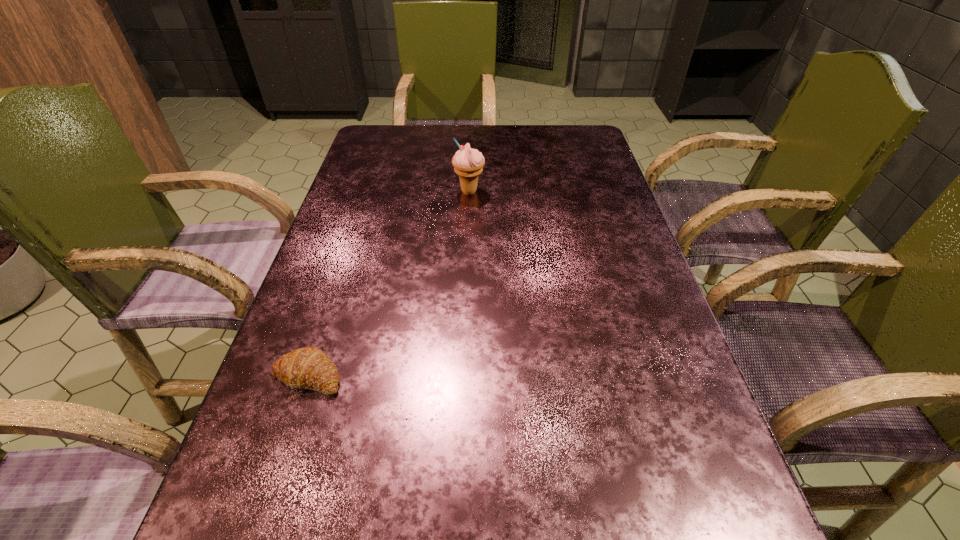
Image resolution: width=960 pixels, height=540 pixels. I want to click on the tallest object, so click(x=468, y=163).

This screenshot has height=540, width=960. Find the location of `the farthest object`. the farthest object is located at coordinates (468, 163).

I want to click on the second nearest object, so click(x=306, y=368).

You are a GUI agent. You are given a task and a screenshot of the screen. Output one action in this format:
    pyautogui.click(x=<x>, y=<y>)
    Task: Click on the farther crescent roll
    
    Given the screenshot: What is the action you would take?
    pyautogui.click(x=306, y=368)

This screenshot has width=960, height=540. I want to click on vacant space located on the back of the tallest object, so click(470, 148).

The width and height of the screenshot is (960, 540). In order to click on free space located 0.080m on the front of the leftmost object in this screenshot , I will do click(285, 443).

You are a GUI agent. You are given a task and a screenshot of the screen. Output one action in this format:
    pyautogui.click(x=<x>, y=<y>)
    Task: Click on the object located at the left edge
    
    Given the screenshot: What is the action you would take?
    pyautogui.click(x=306, y=368)

Identify the location of blank area at the far edge. (537, 145).

Where is `vacant space at the left edge of the desktop`? vacant space at the left edge of the desktop is located at coordinates (366, 287).

In the image, there is a desktop. What are the coordinates of `vacant space at the right edge` in the screenshot? It's located at (660, 326).